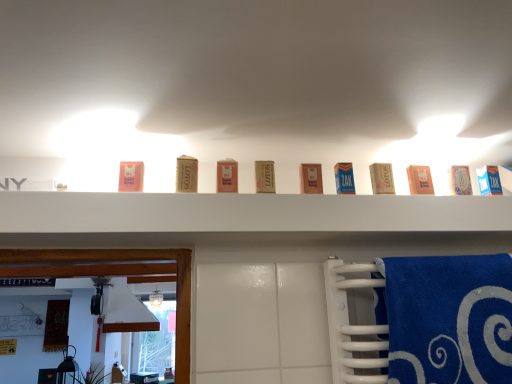
Question: Does matte cardboard box at center, which is the 5th product from left to right, lie in front of blue soft towel at right?

Choices:
 (A) no
 (B) yes

Answer: (A)

Question: Can you confirm if matte cardboard box at center, which is the 5th product from left to right, is taller than blue soft towel at right?

Choices:
 (A) yes
 (B) no

Answer: (B)

Question: Is matte cardboard box at center, which is the 6th product in right-to-left order, located outside blue soft towel at right?

Choices:
 (A) yes
 (B) no

Answer: (A)

Question: Can you confirm if matte cardboard box at center, which is the 6th product in right-to-left order, is smaller than blue soft towel at right?

Choices:
 (A) no
 (B) yes

Answer: (B)

Question: Could blue soft towel at right be considered to be inside matte cardboard box at center, which is the 5th product from left to right?

Choices:
 (A) no
 (B) yes

Answer: (A)

Question: From a real-world perspective, is matte gold box at center, marked as the fourth product in a right-to-left arrangement, above or below blue cardboard box at center, positioned as the sixth product in left-to-right order?

Choices:
 (A) above
 (B) below

Answer: (A)

Question: Is point (371, 170) closer or farther from the camera than point (349, 168)?

Choices:
 (A) closer
 (B) farther

Answer: (B)

Question: Would you say matte gold box at center, marked as the fourth product in a right-to-left arrangement, is to the left or to the right of blue cardboard box at center, which appears as the fifth product when viewed from the right, in the picture?

Choices:
 (A) right
 (B) left

Answer: (A)

Question: Based on their sizes in the image, would you say matte gold box at center, the seventh product positioned from the left, is bigger or smaller than blue cardboard box at center, which appears as the fifth product when viewed from the right?

Choices:
 (A) big
 (B) small

Answer: (A)

Question: From the image's perspective, relative to matte brown soap at center, which is the second product from left to right, is blue soft towel at right above or below?

Choices:
 (A) above
 (B) below

Answer: (B)

Question: Does point (441, 264) appear closer or farther from the camera than point (178, 157)?

Choices:
 (A) farther
 (B) closer

Answer: (A)

Question: Relative to matte brown soap at center, placed as the 9th product when sorted from right to left, is blue soft towel at right in front or behind?

Choices:
 (A) behind
 (B) front

Answer: (B)

Question: Is blue soft towel at right wider or thinner than matte brown soap at center, placed as the 9th product when sorted from right to left?

Choices:
 (A) thin
 (B) wide

Answer: (B)

Question: In terms of height, does pink matte soap at upper center, positioned as the tenth product in right-to-left order, look taller or shorter compared to blue cardboard box at upper right, which is the 10th product in left-to-right order?

Choices:
 (A) short
 (B) tall

Answer: (A)

Question: Choose the correct answer: Is pink matte soap at upper center, positioned as the tenth product in right-to-left order, inside blue cardboard box at upper right, which is the 1th product from right to left, or outside it?

Choices:
 (A) inside
 (B) outside

Answer: (B)